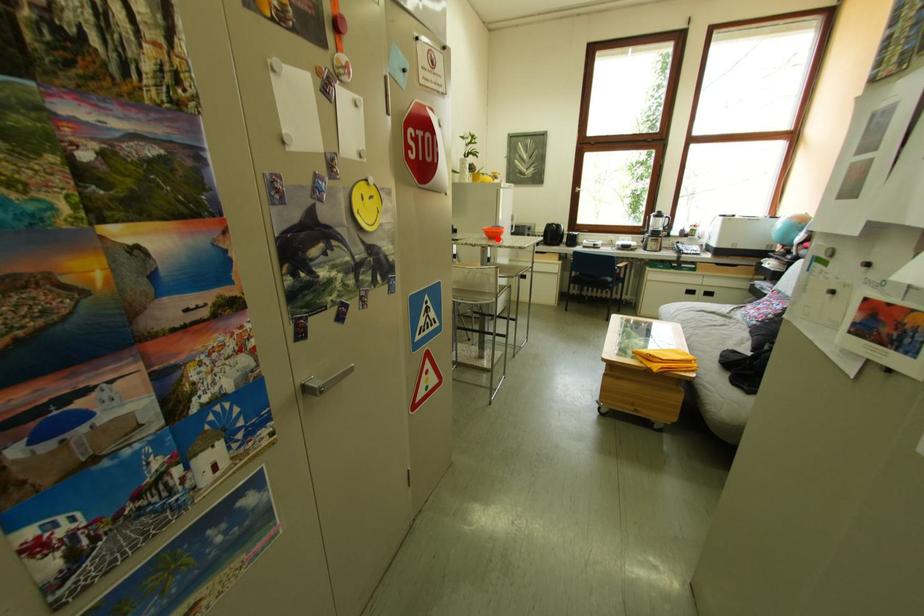
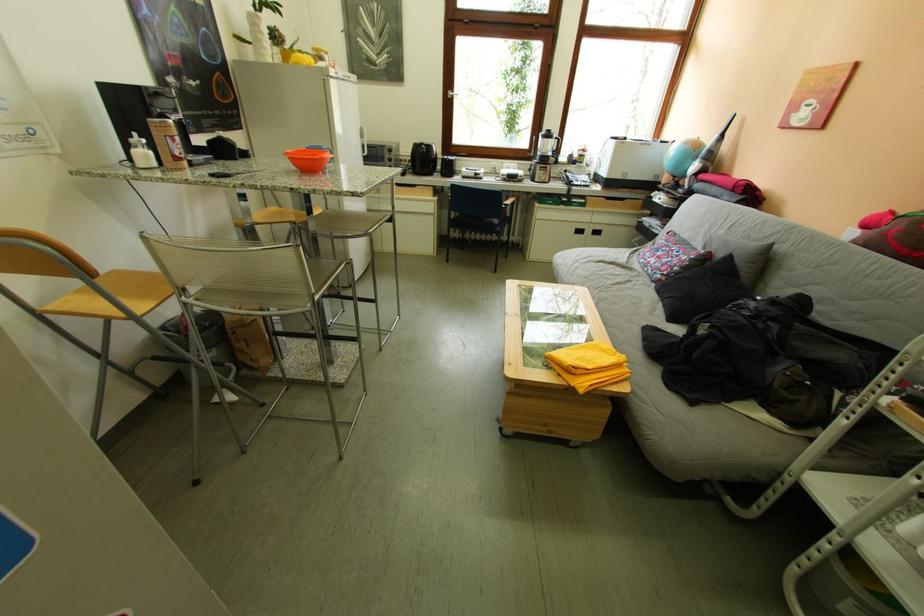
Locate, in the second image, the point that corresponds to the highlighted location in the first image.

(305, 169)